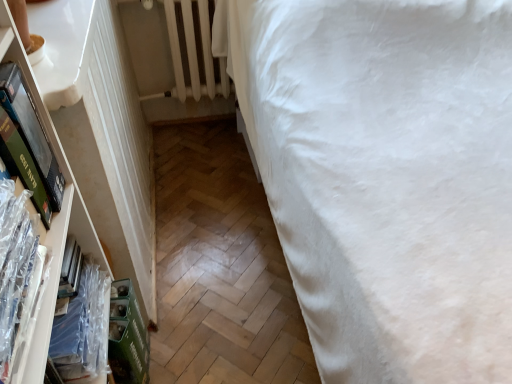
Question: Can you confirm if clear plastic book at left, which is the 2th book in front-to-back order, is thinner than clear plastic book at left, the 1th book viewed from the front?

Choices:
 (A) yes
 (B) no

Answer: (B)

Question: Is clear plastic book at left, which ranks as the 1th book in back-to-front order, positioned in front of clear plastic book at left, arranged as the second book when viewed from the back?

Choices:
 (A) yes
 (B) no

Answer: (B)

Question: Is clear plastic book at left, which ranks as the 1th book in back-to-front order, further to the viewer compared to clear plastic book at left, the 1th book viewed from the front?

Choices:
 (A) yes
 (B) no

Answer: (A)

Question: Does clear plastic book at left, which is the 2th book in front-to-back order, turn towards clear plastic book at left, arranged as the second book when viewed from the back?

Choices:
 (A) yes
 (B) no

Answer: (B)

Question: From the image's perspective, is clear plastic book at left, which ranks as the 1th book in back-to-front order, below clear plastic book at left, the 1th book viewed from the front?

Choices:
 (A) yes
 (B) no

Answer: (A)

Question: Is clear plastic book at left, which ranks as the 1th book in back-to-front order, shorter than clear plastic book at left, the 1th book viewed from the front?

Choices:
 (A) no
 (B) yes

Answer: (B)

Question: Is there a large distance between white painted metal radiator at upper left and clear plastic book at left, which ranks as the 1th book in back-to-front order?

Choices:
 (A) no
 (B) yes

Answer: (B)

Question: From the image's perspective, is white painted metal radiator at upper left above clear plastic book at left, which is the 2th book in front-to-back order?

Choices:
 (A) yes
 (B) no

Answer: (A)

Question: Is white painted metal radiator at upper left wider than clear plastic book at left, which is the 2th book in front-to-back order?

Choices:
 (A) yes
 (B) no

Answer: (B)

Question: Is white painted metal radiator at upper left at the right side of clear plastic book at left, which is the 2th book in front-to-back order?

Choices:
 (A) no
 (B) yes

Answer: (B)

Question: Is white painted metal radiator at upper left aimed at clear plastic book at left, which ranks as the 1th book in back-to-front order?

Choices:
 (A) yes
 (B) no

Answer: (A)

Question: From a real-world perspective, is white painted metal radiator at upper left under clear plastic book at left, which is the 2th book in front-to-back order?

Choices:
 (A) yes
 (B) no

Answer: (B)

Question: Is white cotton bed at right beside clear plastic book at left, which is the 2th book in front-to-back order?

Choices:
 (A) no
 (B) yes

Answer: (A)